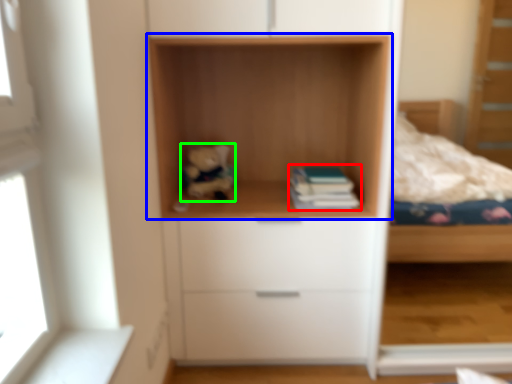
Question: Based on their relative distances, which object is farther from paperback book (highlighted by a red box)? Choose from shelf (highlighted by a blue box) and toy (highlighted by a green box).

Choices:
 (A) shelf
 (B) toy

Answer: (B)